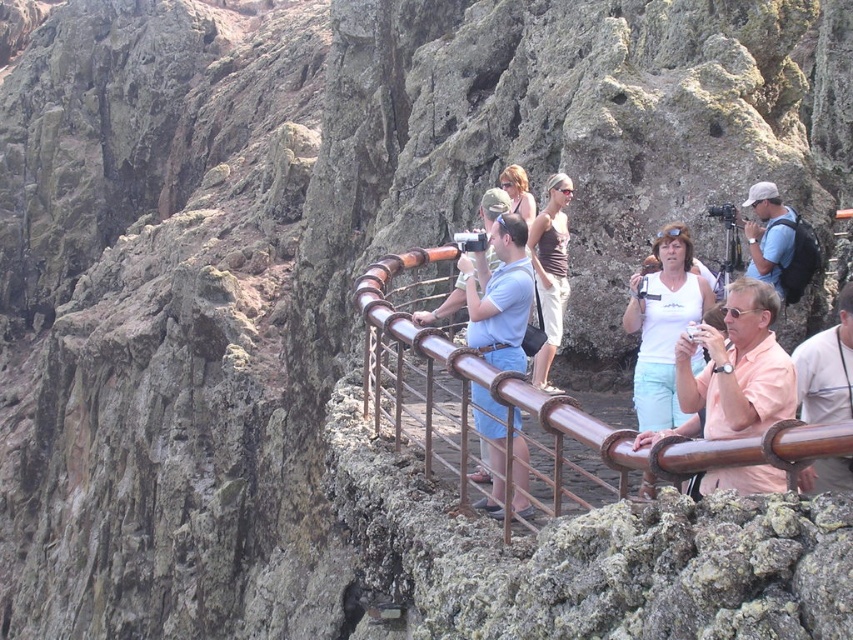
From the picture: You are a photographer standing on the walkway and want to take a photo of the white matte tank top at center and the pink matte shirt at center. Which one is closer to the camera?

The pink matte shirt at center is closer to the camera since the white matte tank top at center is behind it.

You are standing on the elevated walkway and want to take a photo of the brown metal railing at center. Your camera has a maximum focus range of 20 meters. Will the camera be able to focus on the railing?

The distance between you and the brown metal railing at center is 18.91 meters, which is within the camera maximum focus range of 20 meters. Therefore, the camera can focus on the railing.